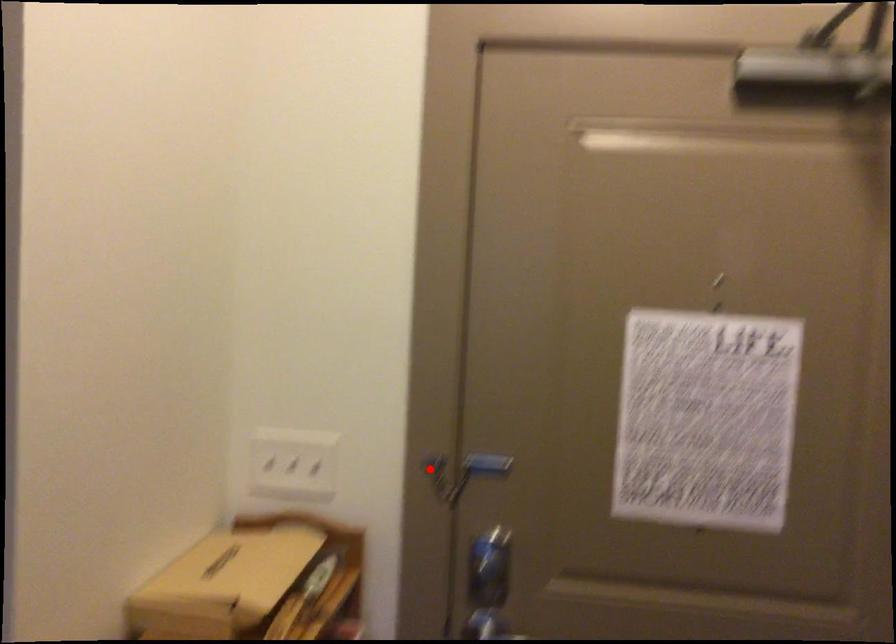
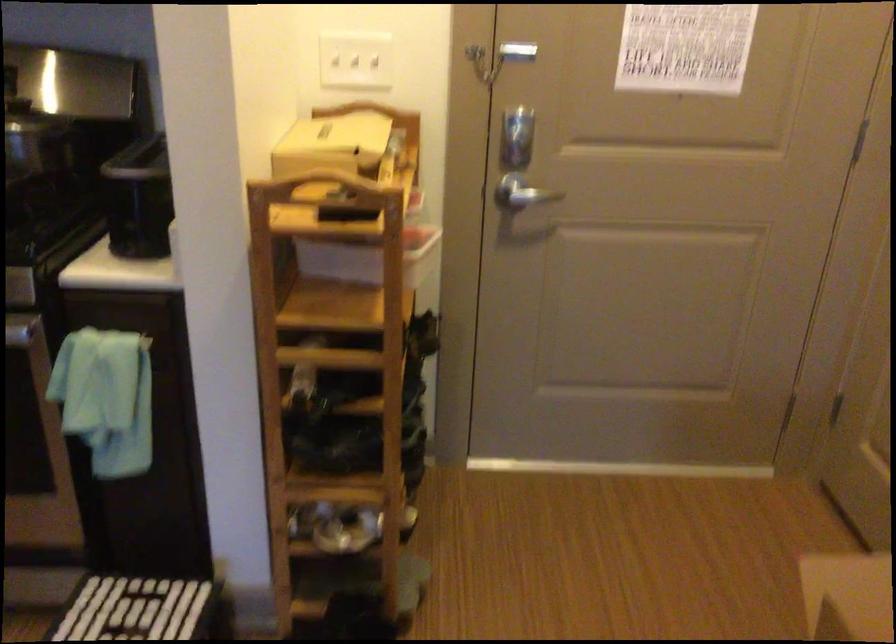
Question: I am providing you with two images of the same scene from different viewpoints. Given a red point in image1, look at the same physical point in image2. Is it:

Choices:
 (A) Closer to the viewpoint
 (B) Farther from the viewpoint

Answer: (B)